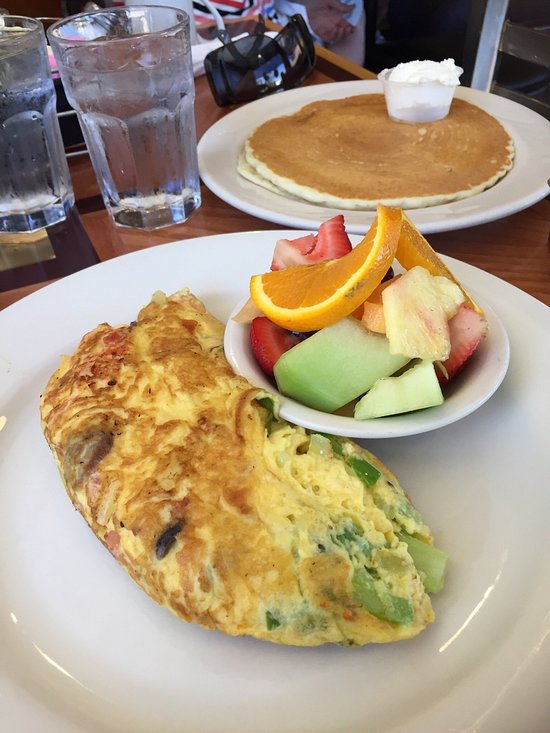
Where is `plastic cup`? plastic cup is located at coordinates (409, 95).